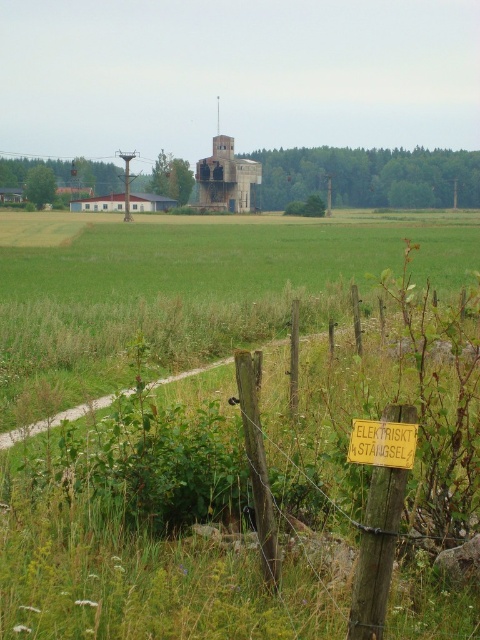
You are a farmer who needs to hang a new sign that is the same size as the yellow wood sign at lower center on the rustic concrete silo at center. Will the new sign be visible from the ground level?

The rustic concrete silo at center is much taller than the yellow wood sign at lower center, so the new sign will be visible from the ground level since it will be placed on the silo which is elevated higher than the original sign.

You are a hiker walking along the dirt path and see the wooden post at lower right and the yellow wood sign at lower center. Which object is closer to you as you stand on the path?

The wooden post at lower right is closer to you since it is further to the viewer than the yellow wood sign at lower center.